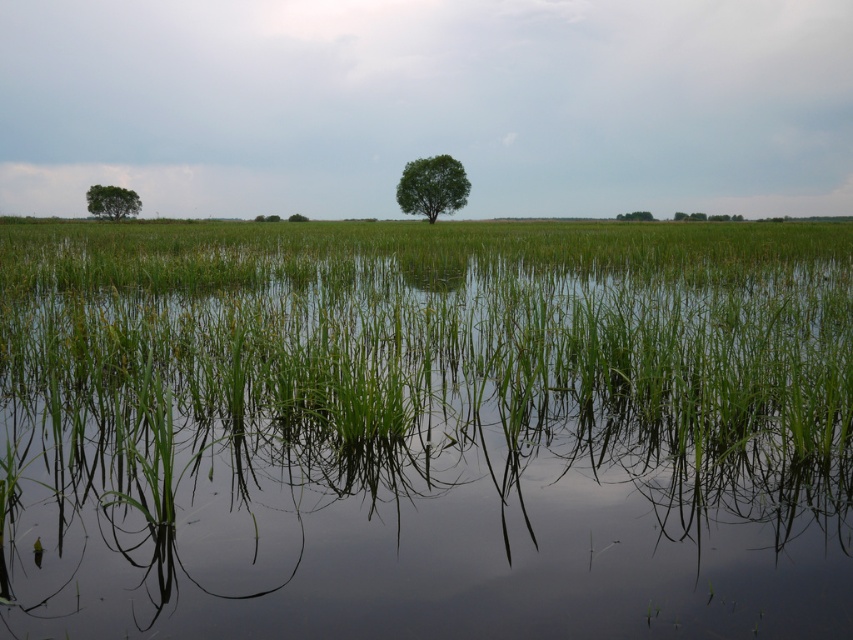
You are standing at the point with coordinates point (114, 209) and want to walk towards the point with coordinates point (642, 212). Which direction should you move to reach it?

To reach point (642, 212) from point (114, 209), you should move upwards because point (114, 209) is in front of point (642, 212), indicating it is closer to the viewer and the other point is further back.

You are a bird looking for a higher perch to get a better view of the landscape. Which tree should you choose between the green leafy tree at upper right and the green matte tree at center?

The green leafy tree at upper right is taller than the green matte tree at center, so you should choose the green leafy tree at upper right for a higher perch.

You are standing at the point marked by the coordinates point (432, 186). Looking around, you see the green leafy tree at center. Which direction should you face to look towards the green leafy tree at center?

Since the point (432, 186) is the location of the green leafy tree at center, you are already facing the tree. There is no need to change direction.